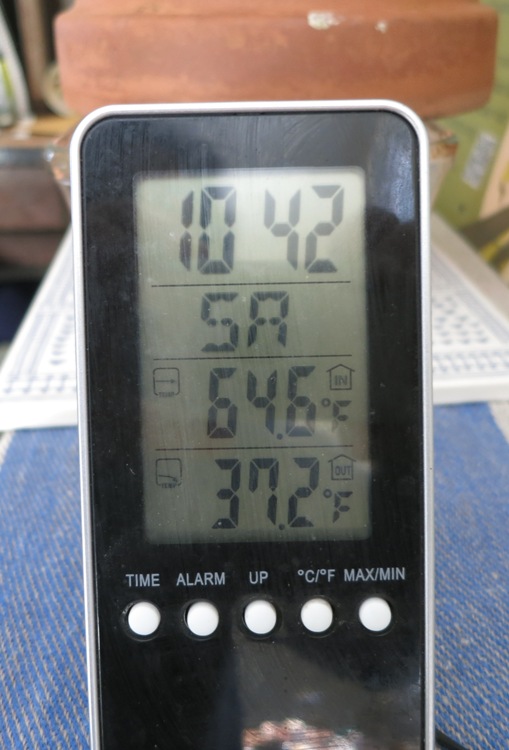
Find the location of a particular element. white buttons on remote is located at coordinates (143, 621), (208, 619), (267, 619), (327, 616), (382, 616).